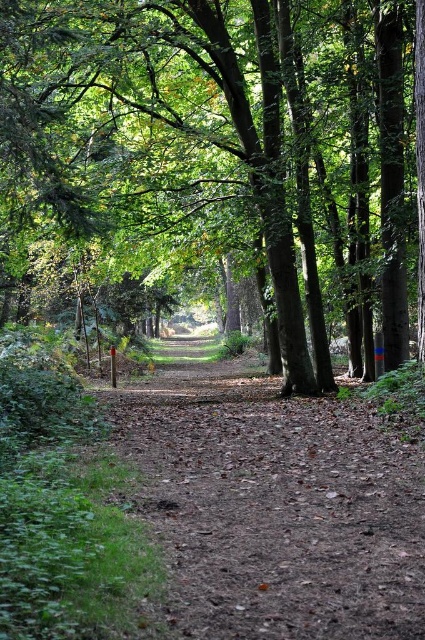
Is brown textured tree at center taller than dirt path at center?

Correct, brown textured tree at center is much taller as dirt path at center.

Between brown textured tree at center and dirt path at center, which one appears on the left side from the viewer's perspective?

From the viewer's perspective, brown textured tree at center appears more on the left side.

This screenshot has height=640, width=425. Identify the location of brown textured tree at center. (221, 154).